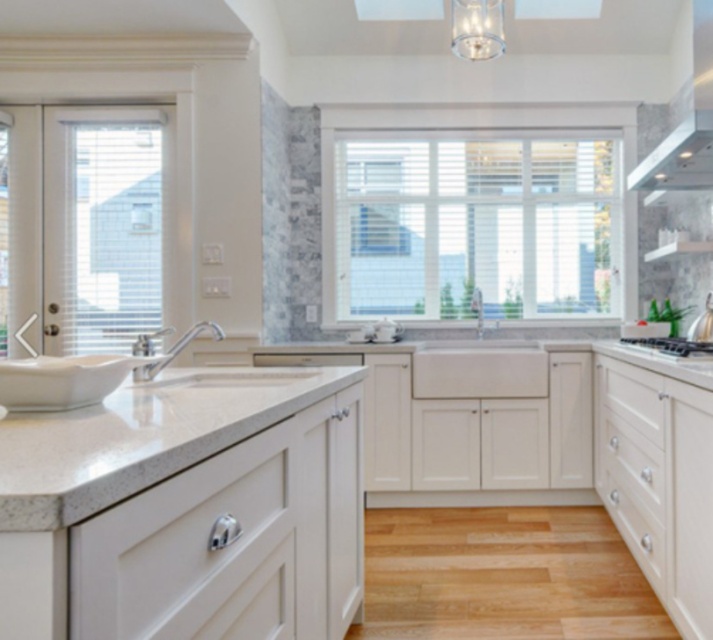
You are standing in the modern kitchen described. There is a point marked at coordinates (473, 227). What object is located at this point?

The point at coordinates (473, 227) marks the white wood window at center.